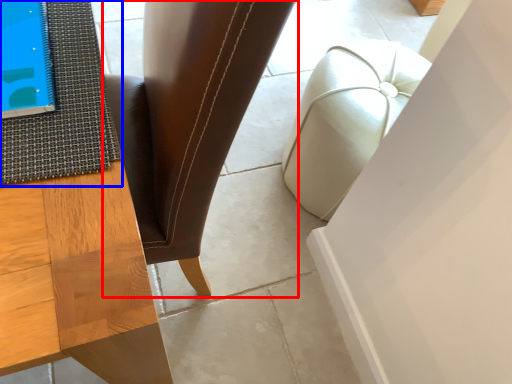
Question: Which object is further to the camera taking this photo, chair (highlighted by a red box) or mat (highlighted by a blue box)?

Choices:
 (A) chair
 (B) mat

Answer: (B)